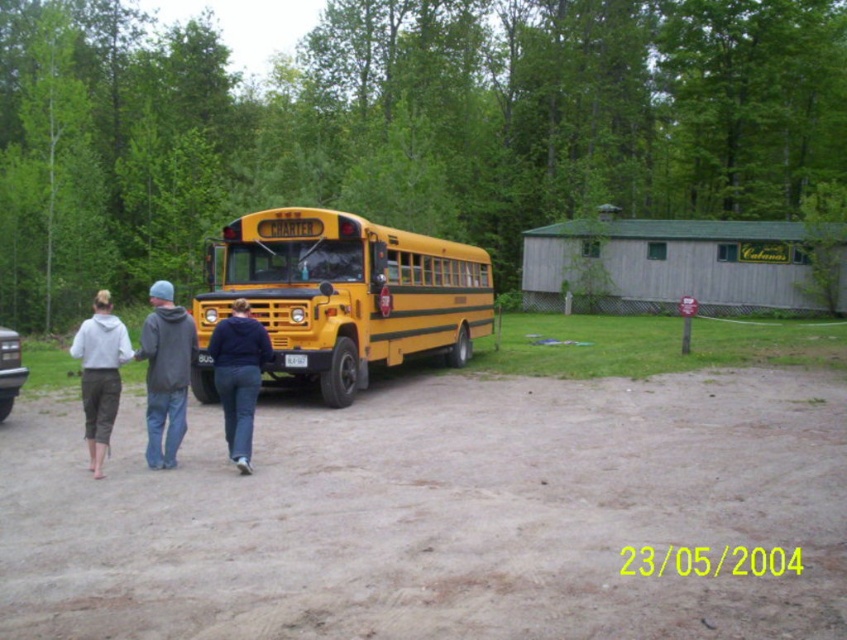
Question: Which point appears closest to the camera in this image?

Choices:
 (A) (231, 438)
 (B) (153, 456)

Answer: (B)

Question: Is gray hoodie at center wider than navy blue hoodie at center?

Choices:
 (A) no
 (B) yes

Answer: (B)

Question: Can you confirm if yellow matte bus at center is positioned to the right of navy blue hoodie at center?

Choices:
 (A) no
 (B) yes

Answer: (A)

Question: Estimate the real-world distances between objects in this image. Which object is farther from the matte gray hoodie at lower left?

Choices:
 (A) navy blue hoodie at center
 (B) yellow matte bus at center
 (C) gray hoodie at center

Answer: (B)

Question: Among these objects, which one is nearest to the camera?

Choices:
 (A) navy blue hoodie at center
 (B) yellow matte bus at center
 (C) matte gray hoodie at lower left

Answer: (C)

Question: Is gray hoodie at center below navy blue hoodie at center?

Choices:
 (A) yes
 (B) no

Answer: (B)